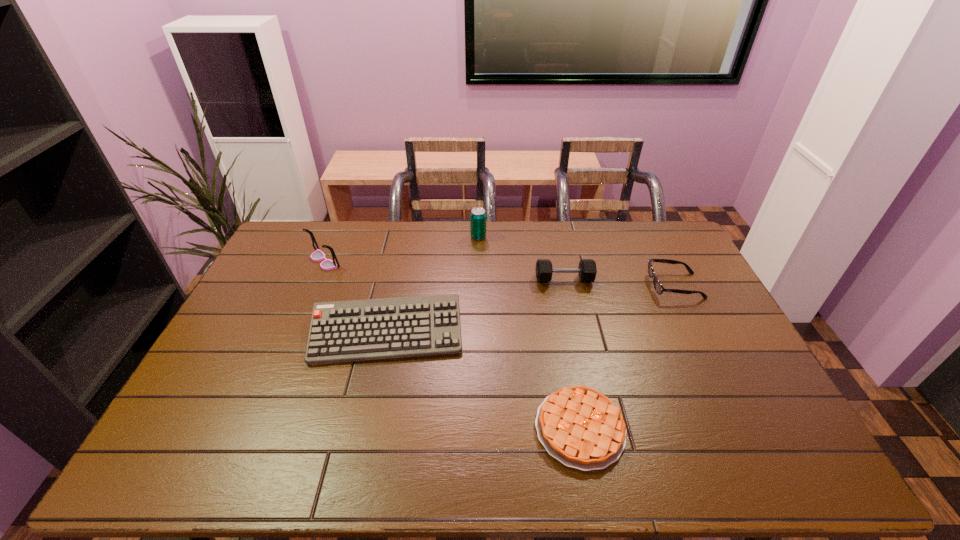
Locate an element on the screen. The width and height of the screenshot is (960, 540). free location that satisfies the following two spatial constraints: 1. on the back side of the pie; 2. on the left side of the dumbbell is located at coordinates click(x=552, y=280).

Image resolution: width=960 pixels, height=540 pixels. I want to click on free location that satisfies the following two spatial constraints: 1. on the back side of the farthest object; 2. on the right side of the left spectacles, so click(334, 237).

Where is `free space that satisfies the following two spatial constraints: 1. on the back side of the nearest object; 2. on the left side of the dumbbell`? This screenshot has width=960, height=540. free space that satisfies the following two spatial constraints: 1. on the back side of the nearest object; 2. on the left side of the dumbbell is located at coordinates (552, 280).

Locate an element on the screen. The width and height of the screenshot is (960, 540). free region that satisfies the following two spatial constraints: 1. on the back side of the dumbbell; 2. on the left side of the computer keyboard is located at coordinates (398, 280).